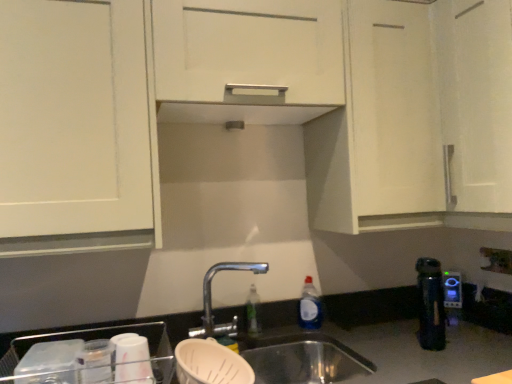
The width and height of the screenshot is (512, 384). In order to click on stainless steel sink at lower center in this screenshot , I will do `click(303, 359)`.

Where is `white plastic electric outlet at lower right`? The image size is (512, 384). white plastic electric outlet at lower right is located at coordinates (496, 260).

Identify the location of white matte cabinet at upper center. (253, 109).

Is white matte cabinet at upper center positioned far away from blue plastic kettle at right?

No, white matte cabinet at upper center is in close proximity to blue plastic kettle at right.

Visually, is white matte cabinet at upper center positioned to the left or to the right of blue plastic kettle at right?

Based on their positions, white matte cabinet at upper center is located to the left of blue plastic kettle at right.

You are a GUI agent. You are given a task and a screenshot of the screen. Output one action in this format:
    pyautogui.click(x=<x>, y=<y>)
    Task: Click on the cabinetry above the blue plastic kettle at right (from the image's perspective)
    The height and width of the screenshot is (384, 512).
    Given the screenshot: What is the action you would take?
    pyautogui.click(x=253, y=109)

Is point (388, 174) less distant than point (444, 299)?

That is True.

Which object is wider, stainless steel sink at lower center or blue plastic kettle at right?

Wider between the two is stainless steel sink at lower center.

Is stainless steel sink at lower center aimed at blue plastic kettle at right?

No, stainless steel sink at lower center is not facing towards blue plastic kettle at right.

Considering the positions of objects stainless steel sink at lower center and blue plastic kettle at right in the image provided, who is behind, stainless steel sink at lower center or blue plastic kettle at right?

blue plastic kettle at right is further away from the camera.

From the image's perspective, is stainless steel sink at lower center under blue plastic kettle at right?

Yes, from the image's perspective, stainless steel sink at lower center is beneath blue plastic kettle at right.

Consider the image. Which is less distant, (449,280) or (203,116)?

Clearly, point (449,280) is more distant from the camera than point (203,116).

Can you tell me how much blue plastic kettle at right and white matte cabinet at upper center differ in facing direction?

The angle between the facing direction of blue plastic kettle at right and the facing direction of white matte cabinet at upper center is 47.6 degrees.

From the image's perspective, is blue plastic kettle at right above or below white matte cabinet at upper center?

From the image's perspective, blue plastic kettle at right appears below white matte cabinet at upper center.

From a real-world perspective, which is physically below, blue plastic kettle at right or white matte cabinet at upper center?

blue plastic kettle at right is physically lower.

Based on the photo, is white matte cabinet at upper center smaller than stainless steel sink at lower center?

No, white matte cabinet at upper center is not smaller than stainless steel sink at lower center.

Who is taller, white matte cabinet at upper center or stainless steel sink at lower center?

With more height is white matte cabinet at upper center.

Is white matte cabinet at upper center far from stainless steel sink at lower center?

No, there isn't a large distance between white matte cabinet at upper center and stainless steel sink at lower center.

Is white matte cabinet at upper center turned away from white plastic electric outlet at lower right?

That's not correct — white matte cabinet at upper center is not looking away from white plastic electric outlet at lower right.

Are white matte cabinet at upper center and white plastic electric outlet at lower right far apart?

That's not correct — white matte cabinet at upper center is a little close to white plastic electric outlet at lower right.

Between white matte cabinet at upper center and white plastic electric outlet at lower right, which one appears on the right side from the viewer's perspective?

white plastic electric outlet at lower right.

From a real-world perspective, between white plastic electric outlet at lower right and white matte cabinet at upper center, who is vertically lower?

white plastic electric outlet at lower right is physically lower.

Considering the relative sizes of white plastic electric outlet at lower right and white matte cabinet at upper center in the image provided, is white plastic electric outlet at lower right shorter than white matte cabinet at upper center?

Yes, white plastic electric outlet at lower right is shorter than white matte cabinet at upper center.

Locate an element on the screen. cabinetry that appears above the white plastic electric outlet at lower right (from the image's perspective) is located at coordinates (253, 109).

Between white plastic electric outlet at lower right and white matte cabinet at upper center, which one is positioned behind?

white plastic electric outlet at lower right is further away from the camera.

Which object is positioned more to the right, white plastic electric outlet at lower right or stainless steel sink at lower center?

white plastic electric outlet at lower right.

Is white plastic electric outlet at lower right further to camera compared to stainless steel sink at lower center?

Yes, the depth of white plastic electric outlet at lower right is greater than that of stainless steel sink at lower center.

Considering the sizes of objects white plastic electric outlet at lower right and stainless steel sink at lower center in the image provided, who is wider, white plastic electric outlet at lower right or stainless steel sink at lower center?

stainless steel sink at lower center.

In the image, there is a white matte cabinet at upper center. Where is `appliance below it (from the image's perspective)`? The width and height of the screenshot is (512, 384). appliance below it (from the image's perspective) is located at coordinates (452, 289).

Identify the location of sink on the left of blue plastic kettle at right. (303, 359).

When comparing their distances from blue plastic bottle at sink, does stainless steel sink at lower center or white matte cabinet at upper center seem closer?

stainless steel sink at lower center lies closer to blue plastic bottle at sink than the other object.

From the image, which object appears to be farther from white matte cabinet at upper center, stainless steel sink at lower center or white plastic electric outlet at lower right?

white plastic electric outlet at lower right.

Looking at the image, which one is located closer to stainless steel sink at lower center, blue plastic bottle at sink or white plastic electric outlet at lower right?

blue plastic bottle at sink.

Based on the photo, when comparing their distances from white plastic electric outlet at lower right, does stainless steel sink at lower center or blue plastic bottle at sink seem closer?

blue plastic bottle at sink is positioned closer to the anchor white plastic electric outlet at lower right.

Estimate the real-world distances between objects in this image. Which object is further from blue plastic bottle at sink, white plastic electric outlet at lower right or white matte cabinet at upper center?

Among the two, white matte cabinet at upper center is located further to blue plastic bottle at sink.

Estimate the real-world distances between objects in this image. Which object is further from blue plastic bottle at sink, white plastic electric outlet at lower right or blue plastic kettle at right?

Among the two, white plastic electric outlet at lower right is located further to blue plastic bottle at sink.

Which object lies further to the anchor point white plastic electric outlet at lower right, stainless steel sink at lower center or white matte cabinet at upper center?

white matte cabinet at upper center is positioned further to the anchor white plastic electric outlet at lower right.

From the image, which object appears to be nearer to blue plastic kettle at right, white matte cabinet at upper center or stainless steel sink at lower center?

Based on the image, stainless steel sink at lower center appears to be nearer to blue plastic kettle at right.

The width and height of the screenshot is (512, 384). Find the location of `bottle between white matte cabinet at upper center and white plastic electric outlet at lower right`. bottle between white matte cabinet at upper center and white plastic electric outlet at lower right is located at coordinates (310, 307).

You are a GUI agent. You are given a task and a screenshot of the screen. Output one action in this format:
    pyautogui.click(x=<x>, y=<y>)
    Task: Click on the bottle situated between stainless steel sink at lower center and blue plastic kettle at right from left to right
    
    Given the screenshot: What is the action you would take?
    pyautogui.click(x=310, y=307)

What are the coordinates of `bottle between white matte cabinet at upper center and stainless steel sink at lower center in the vertical direction` in the screenshot? It's located at (310, 307).

Find the location of a particular element. The width and height of the screenshot is (512, 384). bottle between white matte cabinet at upper center and blue plastic kettle at right in the horizontal direction is located at coordinates (310, 307).